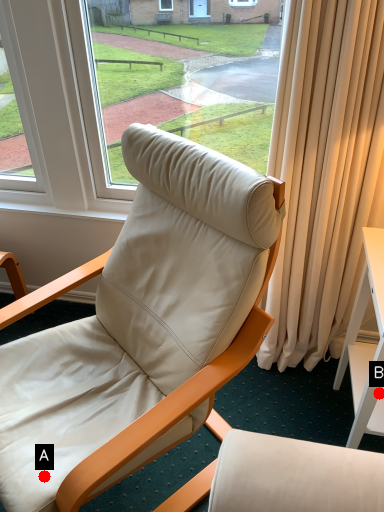
Question: Two points are circled on the image, labeled by A and B beside each circle. Which point is closer to the camera?

Choices:
 (A) A is closer
 (B) B is closer

Answer: (A)